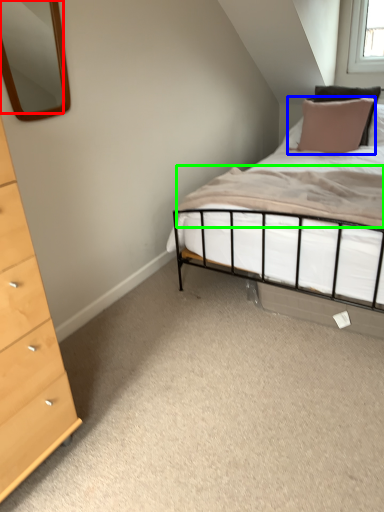
Question: Which object is the closest to the mirror (highlighted by a red box)? Choose among these: pillow (highlighted by a blue box) or mattress (highlighted by a green box).

Choices:
 (A) pillow
 (B) mattress

Answer: (A)